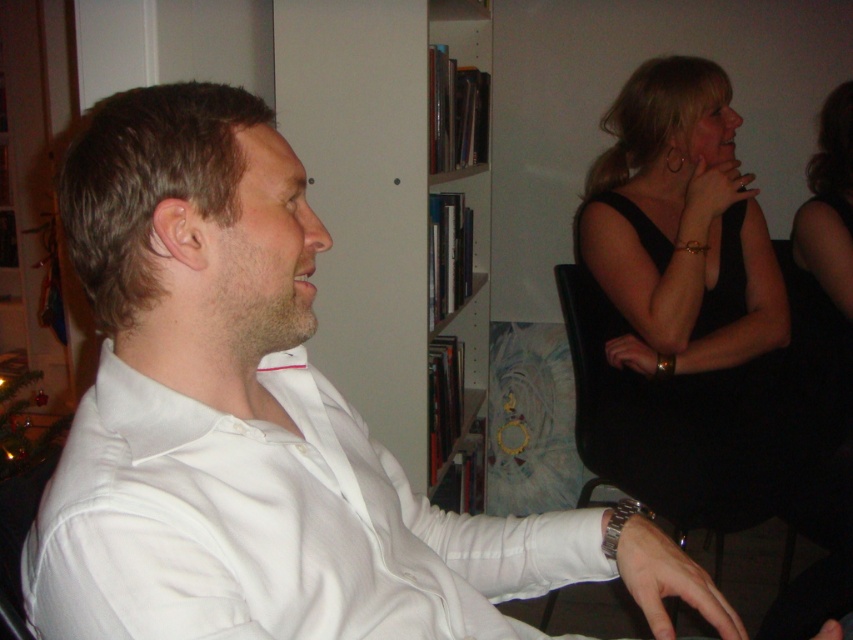
Question: Is white smooth shirt at left below black satin dress at upper right?

Choices:
 (A) yes
 (B) no

Answer: (A)

Question: Among these objects, which one is nearest to the camera?

Choices:
 (A) white smooth shirt at left
 (B) white smooth shirt at center

Answer: (B)

Question: Which object appears closest to the camera in this image?

Choices:
 (A) black satin dress at upper right
 (B) white glossy bookshelf at center

Answer: (B)

Question: Does white smooth shirt at left come behind black leather chair at upper right?

Choices:
 (A) no
 (B) yes

Answer: (A)

Question: Which point is farther to the camera?

Choices:
 (A) (x=331, y=451)
 (B) (x=693, y=166)

Answer: (B)

Question: Is white smooth shirt at left bigger than black leather chair at upper right?

Choices:
 (A) yes
 (B) no

Answer: (B)